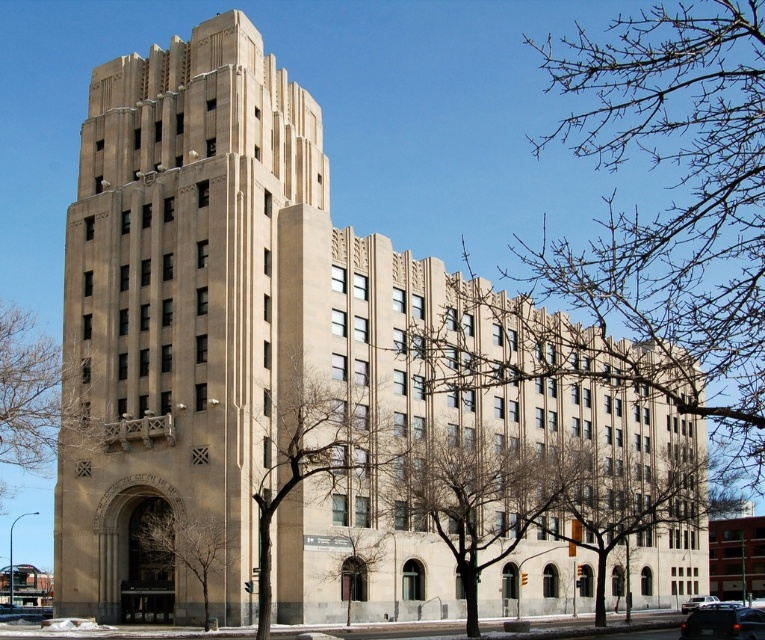
Question: Estimate the real-world distances between objects in this image. Which object is closer to the metallic silver sedan at center?

Choices:
 (A) black rubber car at lower right
 (B) beige stone tower at center

Answer: (A)

Question: Is black rubber car at lower right behind metallic silver sedan at center?

Choices:
 (A) yes
 (B) no

Answer: (B)

Question: From the image, what is the correct spatial relationship of beige stone tower at center in relation to black rubber car at lower right?

Choices:
 (A) right
 (B) left

Answer: (B)

Question: Observing the image, what is the correct spatial positioning of black rubber car at lower right in reference to metallic silver sedan at center?

Choices:
 (A) below
 (B) above

Answer: (B)

Question: Which point is closer to the camera taking this photo?

Choices:
 (A) (147, 200)
 (B) (724, 621)

Answer: (B)

Question: Estimate the real-world distances between objects in this image. Which object is closer to the beige stone tower at center?

Choices:
 (A) metallic silver sedan at center
 (B) black rubber car at lower right

Answer: (B)